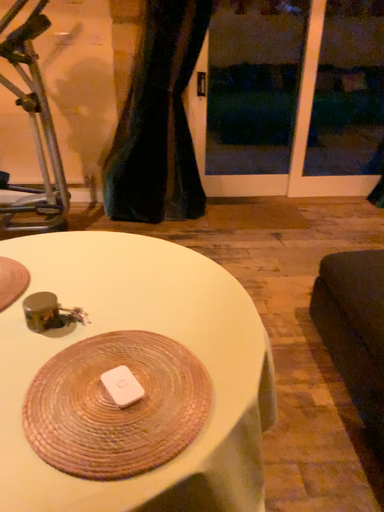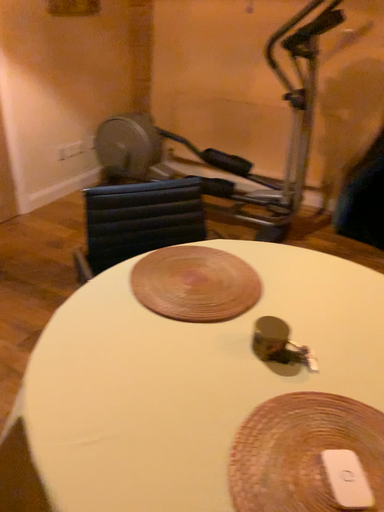
Question: Which way did the camera rotate in the video?

Choices:
 (A) rotated left
 (B) rotated right

Answer: (A)